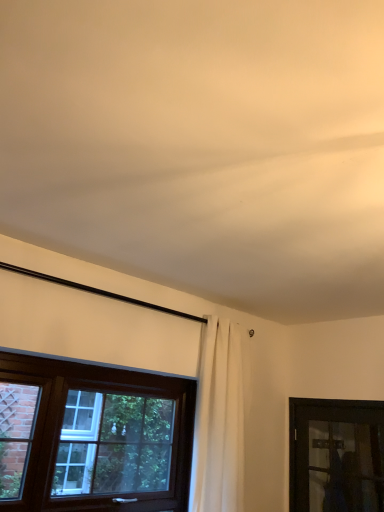
Question: Is white fabric curtain at center inside the boundaries of transparent glass door at lower right, marked as the 1th window in a right-to-left arrangement, or outside?

Choices:
 (A) outside
 (B) inside

Answer: (A)

Question: Looking at the image, does white fabric curtain at center seem bigger or smaller compared to transparent glass door at lower right, which ranks as the second window in left-to-right order?

Choices:
 (A) small
 (B) big

Answer: (B)

Question: Based on their relative distances, which object is nearer to the white fabric curtain at center?

Choices:
 (A) transparent glass door at lower right, which ranks as the second window in left-to-right order
 (B) brown wooden window at lower left, which appears as the 2th window when viewed from the right

Answer: (B)

Question: Estimate the real-world distances between objects in this image. Which object is farther from the white fabric curtain at center?

Choices:
 (A) transparent glass door at lower right, which ranks as the second window in left-to-right order
 (B) brown wooden window at lower left, which appears as the 1th window when viewed from the left

Answer: (A)